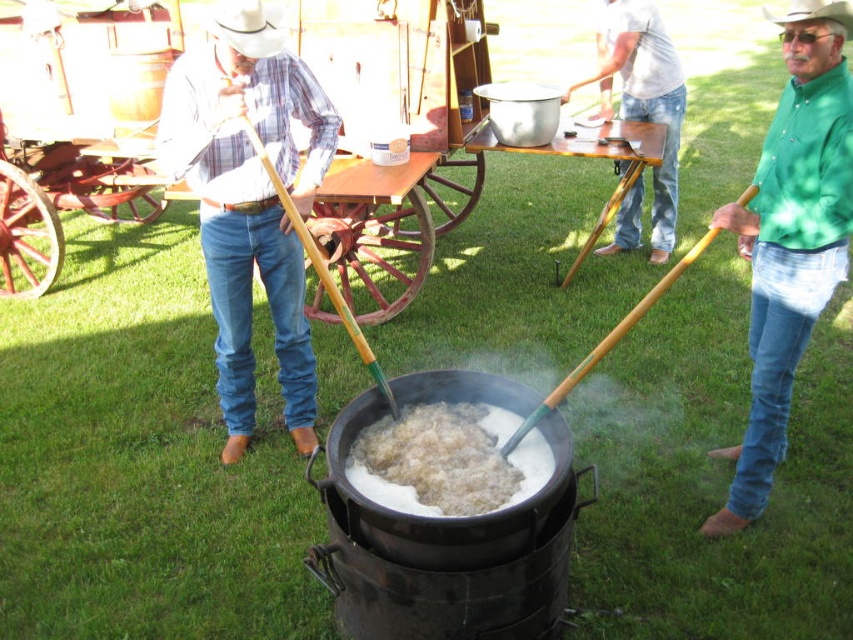
Question: Is matte plaid shirt at center above light gray cotton shirt at upper center?

Choices:
 (A) no
 (B) yes

Answer: (A)

Question: Which of these objects is positioned farthest from the green matte shirt at right?

Choices:
 (A) white fluffy food at center
 (B) light gray cotton shirt at upper center
 (C) green wood shovel at left
 (D) white matte cowboy hat at upper left

Answer: (B)

Question: Which point is closer to the camera taking this photo?

Choices:
 (A) (514, 486)
 (B) (265, 157)
 (C) (636, 320)
 (D) (178, 170)

Answer: (A)

Question: Does white fluffy food at center have a lesser width compared to white felt cowboy hat at upper center?

Choices:
 (A) no
 (B) yes

Answer: (A)

Question: Among these objects, which one is farthest from the camera?

Choices:
 (A) green wood shovel at left
 (B) green matte shirt at right
 (C) white felt cowboy hat at upper center

Answer: (B)

Question: Is light gray cotton shirt at upper center bigger than white felt cowboy hat at upper center?

Choices:
 (A) no
 (B) yes

Answer: (B)